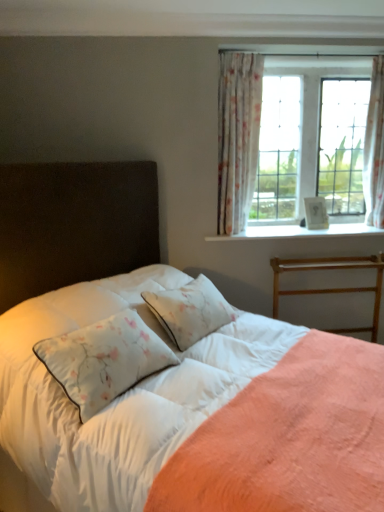
Where is `vacant region below floral sheer curtain at upper right, which appears as the first curtain when viewed from the left (from a real-world perspective)`? Image resolution: width=384 pixels, height=512 pixels. vacant region below floral sheer curtain at upper right, which appears as the first curtain when viewed from the left (from a real-world perspective) is located at coordinates (250, 231).